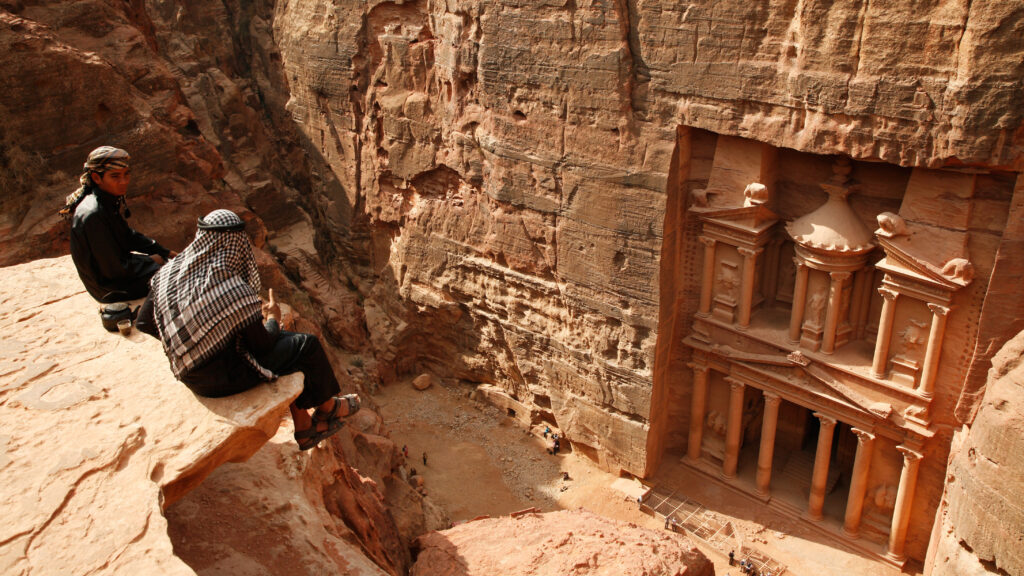
Find the location of `tile`. tile is located at coordinates (687, 514).